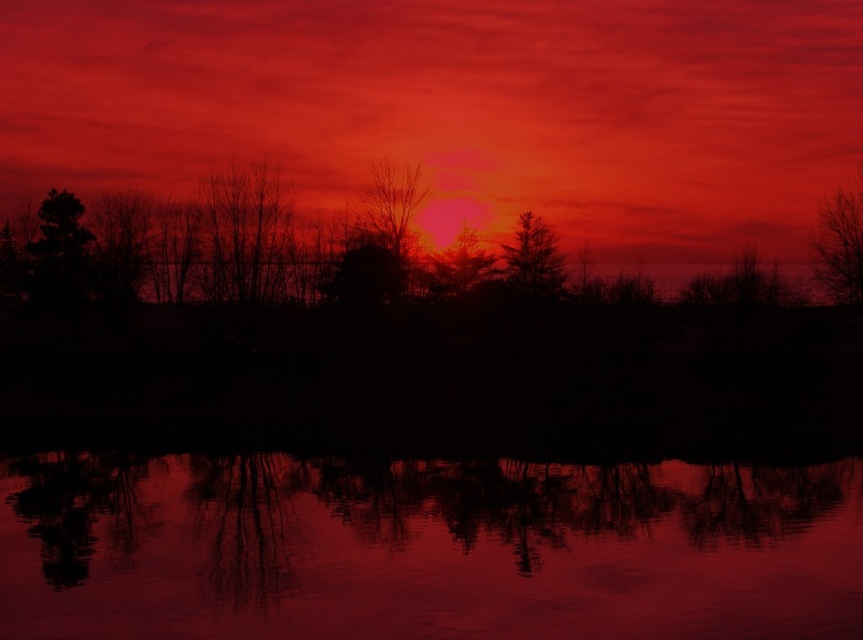
Question: Does glossy water at center appear over matte red tree at center?

Choices:
 (A) yes
 (B) no

Answer: (B)

Question: Considering the real-world distances, which object is farthest from the bare branches at center?

Choices:
 (A) matte red sky at center
 (B) glossy water at center

Answer: (B)

Question: Among these points, which one is farthest from the camera?

Choices:
 (A) click(389, 260)
 (B) click(526, 252)
 (C) click(511, 173)
 (D) click(704, 486)

Answer: (C)

Question: Does glossy water at center have a smaller size compared to matte red tree at center?

Choices:
 (A) yes
 (B) no

Answer: (B)

Question: Which object is closer to the camera taking this photo?

Choices:
 (A) matte red sky at center
 (B) bare branches at center

Answer: (B)

Question: Does silhouette coniferous tree at center have a lesser width compared to matte red tree at center?

Choices:
 (A) yes
 (B) no

Answer: (A)